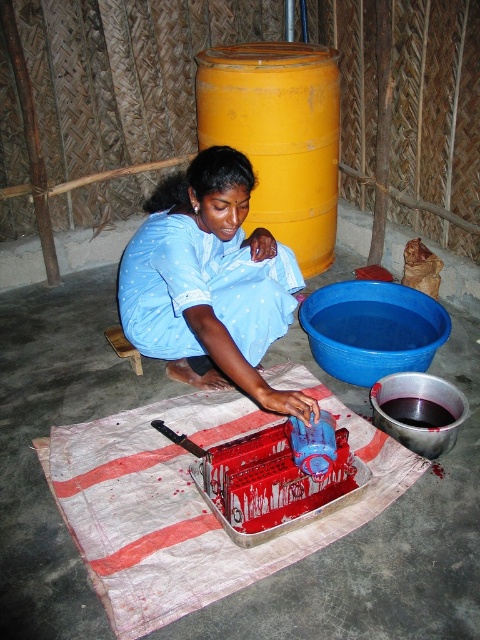
Question: Which object is closer to the camera taking this photo?

Choices:
 (A) metallic silver bowl at lower right
 (B) blue plastic basin at lower center
 (C) blue cotton fabric at center
 (D) yellow matte barrel at upper center

Answer: (C)

Question: Among these points, which one is nearest to the camera?

Choices:
 (A) (288, 182)
 (B) (348, 342)
 (C) (239, 330)

Answer: (C)

Question: Which of the following is the closest to the observer?

Choices:
 (A) (381, 406)
 (B) (376, 342)
 (C) (276, 108)

Answer: (A)

Question: Can you confirm if blue cotton fabric at center is positioned above blue plastic basin at lower center?

Choices:
 (A) no
 (B) yes

Answer: (B)

Question: Does blue cotton fabric at center have a greater width compared to blue plastic basin at lower center?

Choices:
 (A) yes
 (B) no

Answer: (A)

Question: Does blue plastic basin at lower center appear on the right side of metallic silver bowl at lower right?

Choices:
 (A) no
 (B) yes

Answer: (A)